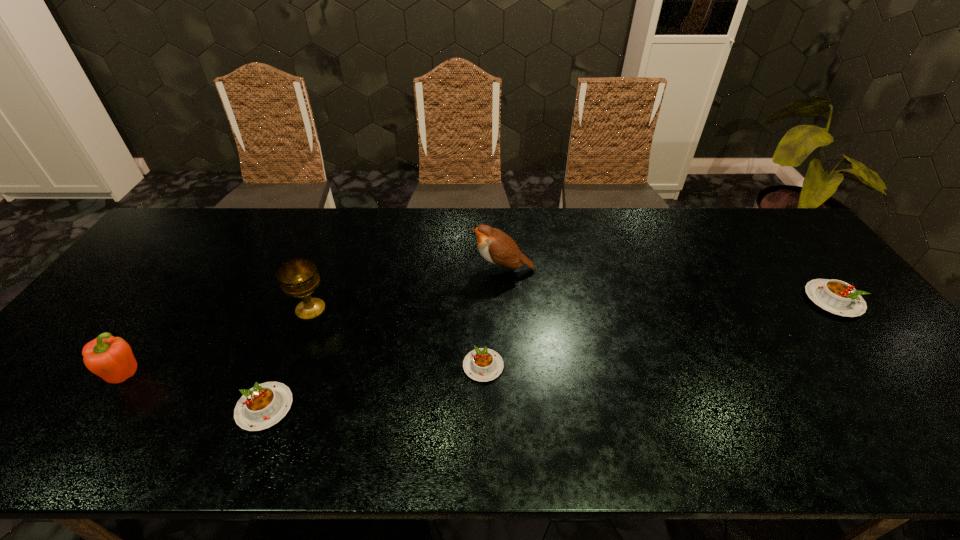
Find the location of a particular element. The image size is (960, 540). the fifth tallest object is located at coordinates (264, 405).

Locate an element on the screen. the nearest pudding is located at coordinates (264, 405).

At what (x,y) coordinates should I click in order to perform the action: click on the shortest pudding. Please return your answer as a coordinate pair (x, y). The height and width of the screenshot is (540, 960). Looking at the image, I should click on (482, 364).

Identify the location of the second nearest pudding. Image resolution: width=960 pixels, height=540 pixels. click(482, 364).

At what (x,y) coordinates should I click in order to perform the action: click on the rightmost pudding. Please return your answer as a coordinate pair (x, y). The image size is (960, 540). Looking at the image, I should click on (838, 297).

This screenshot has height=540, width=960. I want to click on the fourth tallest object, so click(x=838, y=297).

This screenshot has width=960, height=540. I want to click on bird, so click(x=496, y=247).

This screenshot has height=540, width=960. I want to click on the leftmost object, so click(x=111, y=358).

Locate an element on the screen. The height and width of the screenshot is (540, 960). chalice is located at coordinates (299, 278).

Locate an element on the screen. blank space located on the left of the fifth tallest object is located at coordinates (79, 408).